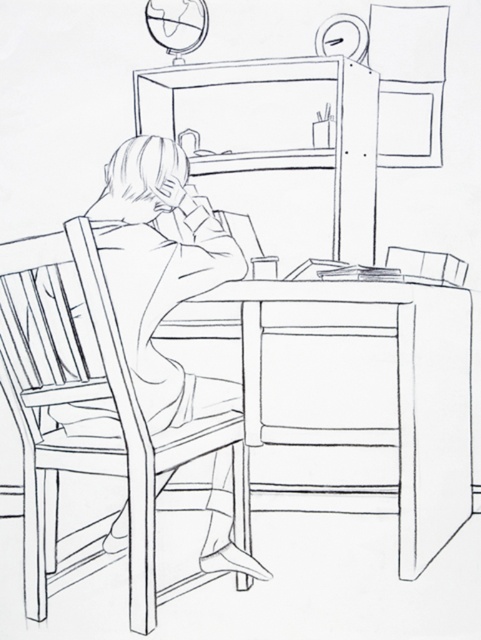
From the picture: Who is lower down, wooden table at center or wooden chair at left?

Positioned lower is wooden table at center.

Is wooden table at center thinner than wooden chair at left?

No.

Between point (427, 508) and point (76, 531), which one is positioned behind?

The point (76, 531) is behind.

Identify the location of wooden table at center. (341, 397).

Is wooden chair at left to the left of wooden chair at right from the viewer's perspective?

Yes, wooden chair at left is to the left of wooden chair at right.

Who is lower down, wooden chair at left or wooden chair at right?

Positioned lower is wooden chair at left.

I want to click on wooden chair at left, so click(110, 413).

Can you confirm if wooden table at center is shorter than wooden chair at right?

Incorrect, wooden table at center's height does not fall short of wooden chair at right's.

Is wooden table at center wider than wooden chair at right?

Correct, the width of wooden table at center exceeds that of wooden chair at right.

In order to click on wooden table at center in this screenshot , I will do `click(341, 397)`.